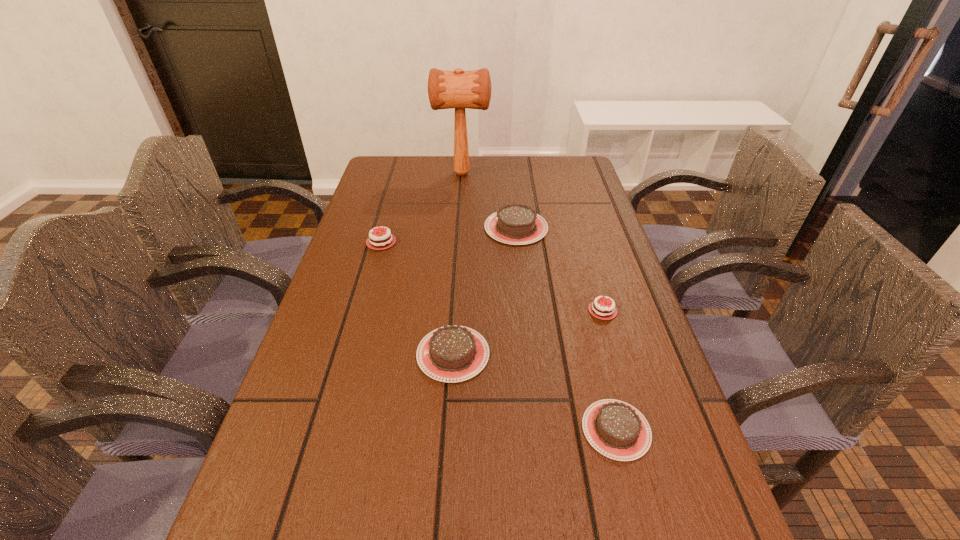
Where is `free space located on the strike surface of the tallest object`? The image size is (960, 540). free space located on the strike surface of the tallest object is located at coordinates (566, 173).

Image resolution: width=960 pixels, height=540 pixels. I want to click on vacant space situated 0.240m on the front of the biggest brown chocolate cake, so click(525, 310).

This screenshot has width=960, height=540. What are the coordinates of `vacant space located 0.200m on the right of the farthest red chocolate cake` in the screenshot? It's located at (493, 242).

The image size is (960, 540). I want to click on vacant space located 0.130m on the right of the second smallest brown chocolate cake, so click(552, 354).

At what (x,y) coordinates should I click in order to perform the action: click on free space located on the left of the second biggest red chocolate cake. Please return your answer as a coordinate pair (x, y). Looking at the image, I should click on (532, 310).

Locate an element on the screen. vacant space located 0.260m on the back of the nearest brown chocolate cake is located at coordinates [585, 303].

Where is `object that is positioned at the far edge`? object that is positioned at the far edge is located at coordinates (458, 89).

Image resolution: width=960 pixels, height=540 pixels. I want to click on object that is at the left edge, so click(375, 245).

In order to click on free space at the far edge in this screenshot , I will do `click(495, 177)`.

Where is `free location at the left edge of the desktop`? The image size is (960, 540). free location at the left edge of the desktop is located at coordinates (291, 392).